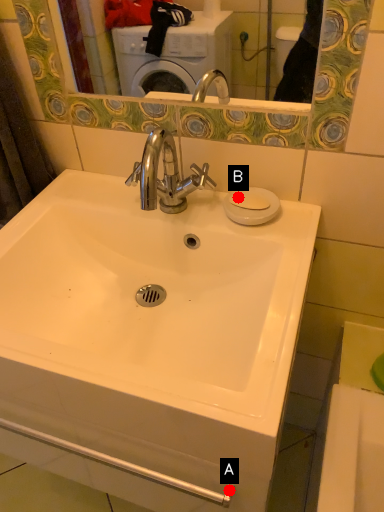
Question: Two points are circled on the image, labeled by A and B beside each circle. Among these points, which one is nearest to the camera?

Choices:
 (A) A is closer
 (B) B is closer

Answer: (A)